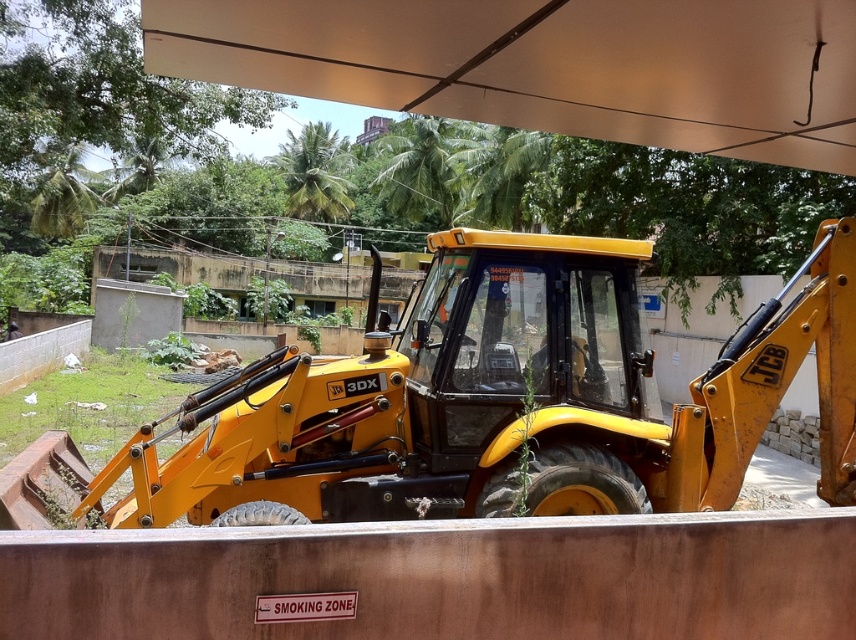
Question: Is yellow metallic tractor at center further to the viewer compared to white matte canopy at upper center?

Choices:
 (A) no
 (B) yes

Answer: (B)

Question: Does yellow metallic tractor at center have a lesser width compared to white matte canopy at upper center?

Choices:
 (A) yes
 (B) no

Answer: (A)

Question: Which point is farther to the camera?

Choices:
 (A) (484, 442)
 (B) (822, 99)

Answer: (A)

Question: Does yellow metallic tractor at center appear on the right side of white matte canopy at upper center?

Choices:
 (A) no
 (B) yes

Answer: (B)

Question: Which point is farther from the camera taking this photo?

Choices:
 (A) click(200, 435)
 (B) click(388, 65)

Answer: (A)

Question: Which point is closer to the camera?

Choices:
 (A) (407, 499)
 (B) (581, 12)

Answer: (B)